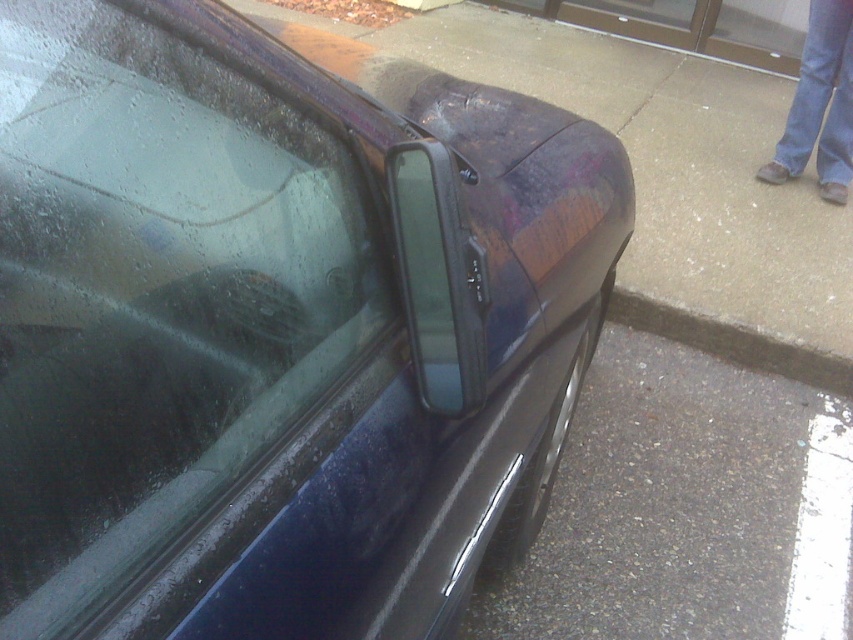
Question: Which point is closer to the camera taking this photo?

Choices:
 (A) (676, 432)
 (B) (358, 99)
 (C) (616, 301)

Answer: (B)

Question: Observing the image, what is the correct spatial positioning of transparent glass windshield at upper left in reference to transparent plastic window at center?

Choices:
 (A) above
 (B) below

Answer: (B)

Question: Can you confirm if transparent glass windshield at upper left is positioned below gray concrete curb at lower right?

Choices:
 (A) yes
 (B) no

Answer: (B)

Question: Which object is the closest to the gray concrete curb at lower right?

Choices:
 (A) transparent glass windshield at upper left
 (B) gray asphalt at lower right
 (C) transparent plastic window at center

Answer: (B)

Question: Among these objects, which one is farthest from the camera?

Choices:
 (A) gray asphalt at lower right
 (B) gray concrete curb at lower right

Answer: (B)

Question: Is gray asphalt at lower right bigger than gray concrete curb at lower right?

Choices:
 (A) yes
 (B) no

Answer: (A)